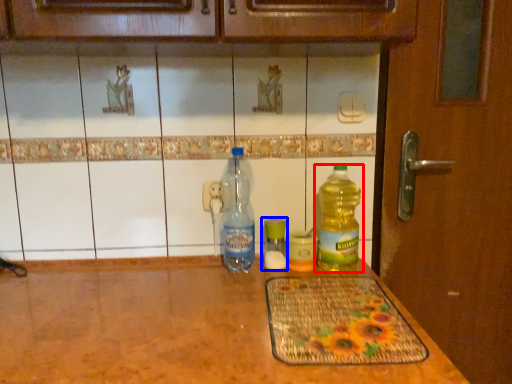
Question: Which of the following is the farthest to the observer, bottle (highlighted by a red box) or bottle (highlighted by a blue box)?

Choices:
 (A) bottle
 (B) bottle

Answer: (B)